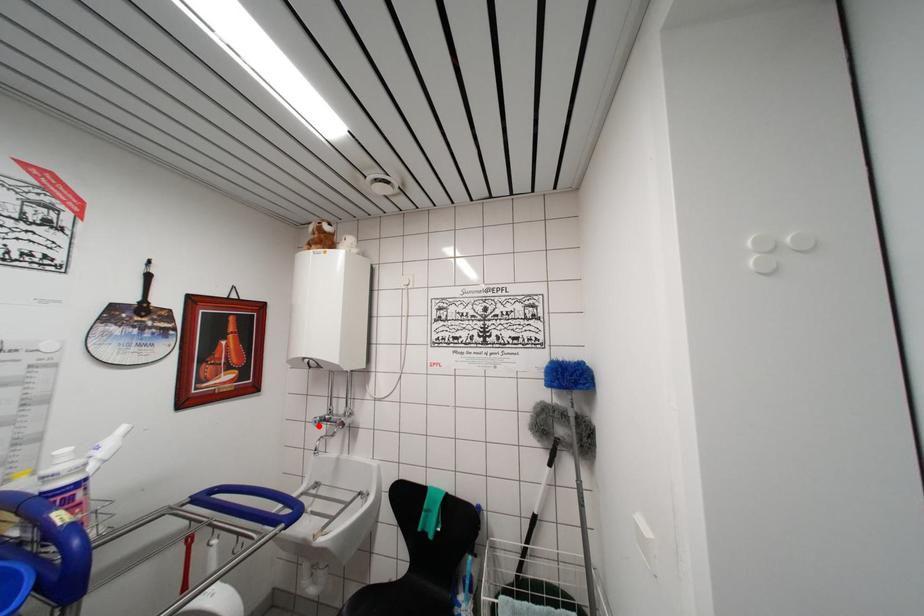
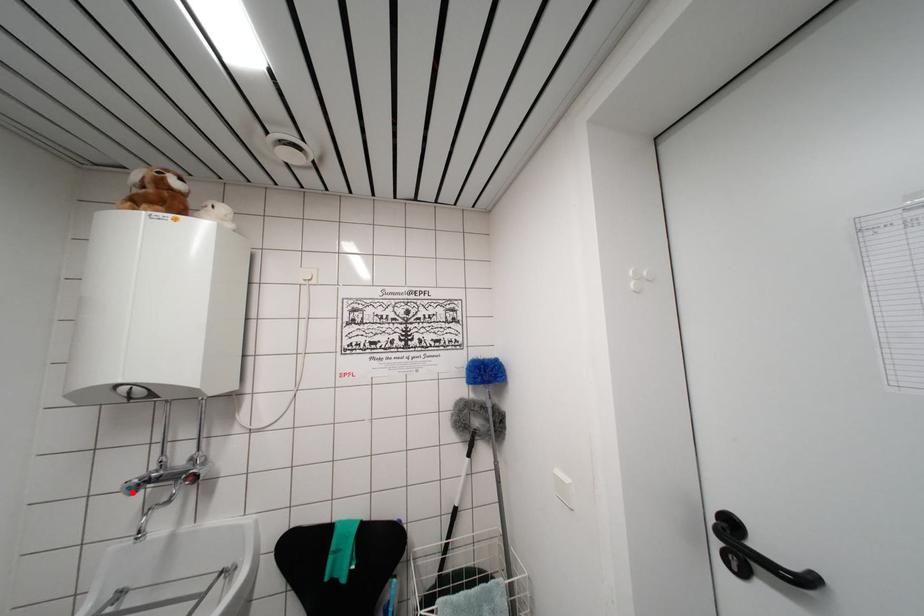
I am providing you with two images of the same scene from different viewpoints. A red point is marked on the first image and another point is marked on the second image. Does the point marked in image1 correspond to the same location as the one in image2?

Yes